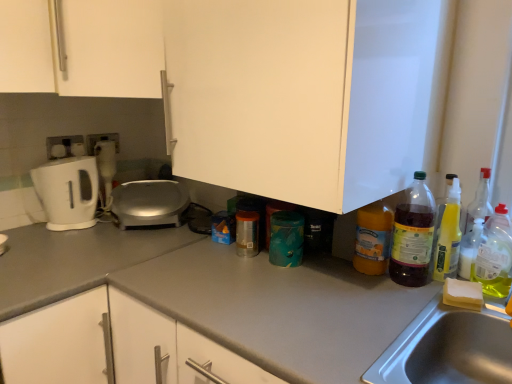
The height and width of the screenshot is (384, 512). What do you see at coordinates (463, 294) in the screenshot?
I see `yellow paper towel at sink right` at bounding box center [463, 294].

The width and height of the screenshot is (512, 384). I want to click on yellow paper towel at sink right, so click(x=463, y=294).

What do you see at coordinates (83, 47) in the screenshot? I see `white matte cabinet at upper left, placed as the 2th cabinetry when sorted from right to left` at bounding box center [83, 47].

Where is `white matte cabinet at upper left, marked as the 1th cabinetry in a left-to-right arrangement`? white matte cabinet at upper left, marked as the 1th cabinetry in a left-to-right arrangement is located at coordinates click(x=83, y=47).

Identify the location of clear plastic bottle at right, positioned as the fifth bottle in left-to-right order. coord(495,255).

Measure the distance between point [102,198] and camera.

1.76 meters.

I want to click on yellow paper towel at sink right, so click(463, 294).

From a real-world perspective, is white plastic coffee machine at left below translucent plastic bottle at right, placed as the second bottle when sorted from left to right?

Yes, from a real-world perspective, white plastic coffee machine at left is under translucent plastic bottle at right, placed as the second bottle when sorted from left to right.

From the image's perspective, which is above, white plastic coffee machine at left or translucent plastic bottle at right, placed as the second bottle when sorted from left to right?

white plastic coffee machine at left, from the image's perspective.

Image resolution: width=512 pixels, height=384 pixels. In order to click on coffee machine below the translucent plastic bottle at right, placed as the second bottle when sorted from left to right (from a real-world perspective) in this screenshot , I will do `click(106, 167)`.

Looking at this image, can you confirm if white plastic coffee machine at left is wider than translucent plastic bottle at right, which appears as the 4th bottle when viewed from the right?

No.

From the image's perspective, is yellow paper towel at sink right positioned above or below clear plastic bottle at right, positioned as the fifth bottle in left-to-right order?

yellow paper towel at sink right is situated lower than clear plastic bottle at right, positioned as the fifth bottle in left-to-right order, in the image.

There is a yellow paper towel at sink right. Identify the location of the 3rd bottle above it (from a real-world perspective). This screenshot has width=512, height=384. (495, 255).

Is yellow paper towel at sink right not inside clear plastic bottle at right, positioned as the fifth bottle in left-to-right order?

Yes, yellow paper towel at sink right is not within clear plastic bottle at right, positioned as the fifth bottle in left-to-right order.

Between point (448, 278) and point (383, 273), which one is positioned in front?

The point (448, 278) is in front.

Between yellow paper towel at sink right and orange matte bottle at lower right, arranged as the 5th bottle when viewed from the right, which one has larger size?

With larger size is orange matte bottle at lower right, arranged as the 5th bottle when viewed from the right.

Considering the sizes of objects yellow paper towel at sink right and orange matte bottle at lower right, the first bottle in the left-to-right sequence, in the image provided, who is thinner, yellow paper towel at sink right or orange matte bottle at lower right, the first bottle in the left-to-right sequence,?

orange matte bottle at lower right, the first bottle in the left-to-right sequence.

You are a GUI agent. You are given a task and a screenshot of the screen. Output one action in this format:
    pyautogui.click(x=<x>, y=<y>)
    Task: Click on the bottle that is the 2nd object to the left of the yellow paper towel at sink right, starting at the anchor
    Image resolution: width=512 pixels, height=384 pixels.
    Given the screenshot: What is the action you would take?
    pyautogui.click(x=373, y=238)

Can you confirm if white plastic coffee machine at left is taller than yellow translucent spray bottle at right, which is the second bottle from right to left?

Correct, white plastic coffee machine at left is much taller as yellow translucent spray bottle at right, which is the second bottle from right to left.

Is white plastic coffee machine at left not close to yellow translucent spray bottle at right, which ranks as the fourth bottle in left-to-right order?

Absolutely, white plastic coffee machine at left is distant from yellow translucent spray bottle at right, which ranks as the fourth bottle in left-to-right order.

Considering the relative positions of white plastic coffee machine at left and yellow translucent spray bottle at right, which is the second bottle from right to left, in the image provided, is white plastic coffee machine at left behind yellow translucent spray bottle at right, which is the second bottle from right to left,?

Yes, white plastic coffee machine at left is further from the camera.

Does point (98, 159) come farther from viewer compared to point (460, 268)?

Yes, point (98, 159) is behind point (460, 268).

Considering the sizes of objects translucent plastic bottle at right, placed as the second bottle when sorted from left to right, and orange matte bottle at lower right, the first bottle in the left-to-right sequence, in the image provided, who is wider, translucent plastic bottle at right, placed as the second bottle when sorted from left to right, or orange matte bottle at lower right, the first bottle in the left-to-right sequence,?

With larger width is translucent plastic bottle at right, placed as the second bottle when sorted from left to right.

Which is more to the right, translucent plastic bottle at right, which appears as the 4th bottle when viewed from the right, or orange matte bottle at lower right, the first bottle in the left-to-right sequence?

translucent plastic bottle at right, which appears as the 4th bottle when viewed from the right.

From a real-world perspective, which object rests below the other?

orange matte bottle at lower right, arranged as the 5th bottle when viewed from the right, from a real-world perspective.

From a real-world perspective, which bottle is the 3rd one above the orange matte bottle at lower right, the first bottle in the left-to-right sequence? Please provide its 2D coordinates.

[(413, 235)]

Which is closer to the camera, (510, 254) or (460, 275)?

Point (510, 254) is closer to the camera than point (460, 275).

From the picture: Which of these two, clear plastic bottle at right, which is the first bottle from right to left, or yellow translucent spray bottle at right, which is the second bottle from right to left, stands shorter?

Standing shorter between the two is yellow translucent spray bottle at right, which is the second bottle from right to left.

Could yellow translucent spray bottle at right, which ranks as the fourth bottle in left-to-right order, be considered to be inside clear plastic bottle at right, positioned as the fifth bottle in left-to-right order?

No, yellow translucent spray bottle at right, which ranks as the fourth bottle in left-to-right order, is located outside of clear plastic bottle at right, positioned as the fifth bottle in left-to-right order.

Consider the image. Is clear plastic bottle at right, which is the first bottle from right to left, wider than yellow translucent spray bottle at right, which ranks as the fourth bottle in left-to-right order?

Indeed, clear plastic bottle at right, which is the first bottle from right to left, has a greater width compared to yellow translucent spray bottle at right, which ranks as the fourth bottle in left-to-right order.

Does point (473, 245) lie in front of point (125, 209)?

Yes, point (473, 245) is closer to viewer.

Is yellow translucent spray bottle at right, which is the second bottle from right to left, to the right of satin silver appliance at center from the viewer's perspective?

Correct, you'll find yellow translucent spray bottle at right, which is the second bottle from right to left, to the right of satin silver appliance at center.

At what (x,y) coordinates should I click in order to perform the action: click on kitchen appliance on the left of yellow translucent spray bottle at right, which ranks as the fourth bottle in left-to-right order. Please return your answer as a coordinate pair (x, y). Looking at the image, I should click on (149, 203).

How many degrees apart are the facing directions of yellow translucent spray bottle at right, which ranks as the fourth bottle in left-to-right order, and satin silver appliance at center?

The angle between the facing direction of yellow translucent spray bottle at right, which ranks as the fourth bottle in left-to-right order, and the facing direction of satin silver appliance at center is 53.5 degrees.

From the white plastic coffee machine at left, count 2nd bottle to the right and point to it. Please provide its 2D coordinates.

[(413, 235)]

Locate an element on the screen. This screenshot has height=384, width=512. the 3rd bottle located above the yellow paper towel at sink right (from a real-world perspective) is located at coordinates (495, 255).

From the image, which object appears to be farther from satin silver appliance at center, gray matte countertop at center or yellow paper towel at sink right?

yellow paper towel at sink right lies further to satin silver appliance at center than the other object.

From the image, which object appears to be farther from white plastic coffee machine at left, yellow paper towel at sink right or white matte cabinet at upper left, marked as the 1th cabinetry in a left-to-right arrangement?

The object further to white plastic coffee machine at left is yellow paper towel at sink right.

Based on their spatial positions, is white plastic coffee machine at left or gray matte countertop at center further from white glossy electric kettle at left?

gray matte countertop at center is positioned further to the anchor white glossy electric kettle at left.

Consider the image. Looking at the image, which one is located further to translucent plastic spray bottle at right, the third bottle in the right-to-left sequence, gray matte countertop at center or white glossy electric kettle at left?

white glossy electric kettle at left.

When comparing their distances from yellow translucent spray bottle at right, which ranks as the fourth bottle in left-to-right order, does white glossy electric kettle at left or satin silver appliance at center seem further?

Based on the image, white glossy electric kettle at left appears to be further to yellow translucent spray bottle at right, which ranks as the fourth bottle in left-to-right order.

Estimate the real-world distances between objects in this image. Which object is closer to white matte cabinet at upper left, marked as the 1th cabinetry in a left-to-right arrangement, orange matte bottle at lower right, arranged as the 5th bottle when viewed from the right, or white matte cabinet at center, which ranks as the first cabinetry in right-to-left order?

Among the two, white matte cabinet at center, which ranks as the first cabinetry in right-to-left order, is located nearer to white matte cabinet at upper left, marked as the 1th cabinetry in a left-to-right arrangement.

Considering their positions, is white plastic coffee machine at left positioned further to white glossy electric kettle at left than yellow paper towel at sink right?

yellow paper towel at sink right lies further to white glossy electric kettle at left than the other object.

Which object lies nearer to the anchor point yellow translucent spray bottle at right, which ranks as the fourth bottle in left-to-right order, white plastic coffee machine at left or white matte cabinet at center, which ranks as the second cabinetry in left-to-right order?

The object closer to yellow translucent spray bottle at right, which ranks as the fourth bottle in left-to-right order, is white matte cabinet at center, which ranks as the second cabinetry in left-to-right order.

The height and width of the screenshot is (384, 512). In order to click on coffee machine between white matte cabinet at upper left, marked as the 1th cabinetry in a left-to-right arrangement, and satin silver appliance at center from top to bottom in this screenshot , I will do `click(106, 167)`.

I want to click on food between orange matte bottle at lower right, arranged as the 5th bottle when viewed from the right, and yellow translucent spray bottle at right, which ranks as the fourth bottle in left-to-right order, in the horizontal direction, so click(463, 294).

Image resolution: width=512 pixels, height=384 pixels. Identify the location of bottle between satin silver appliance at center and translucent plastic bottle at right, which appears as the 4th bottle when viewed from the right, in the horizontal direction. (373, 238).

Locate an element on the screen. bottle between white matte cabinet at upper left, marked as the 1th cabinetry in a left-to-right arrangement, and translucent plastic bottle at right, which appears as the 4th bottle when viewed from the right, in the horizontal direction is located at coordinates (373, 238).